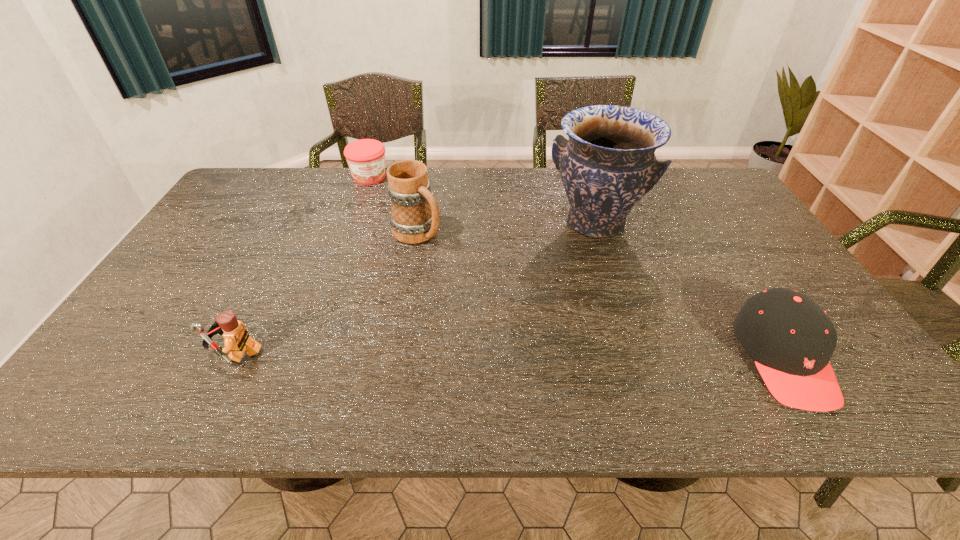
Where is `vacant region located holding a crossbow in the hands of the Lego`? The width and height of the screenshot is (960, 540). vacant region located holding a crossbow in the hands of the Lego is located at coordinates (159, 353).

The image size is (960, 540). Find the location of `vacant space situated on the side of the mug with the handle`. vacant space situated on the side of the mug with the handle is located at coordinates (489, 287).

Where is `free space located 0.120m on the side of the mug with the handle`? free space located 0.120m on the side of the mug with the handle is located at coordinates (461, 266).

At what (x,y) coordinates should I click in order to perform the action: click on vacant space situated on the side of the mug with the handle. Please return your answer as a coordinate pair (x, y). The height and width of the screenshot is (540, 960). Looking at the image, I should click on (444, 254).

Find the location of `vacant region located on the label side of the jam`. vacant region located on the label side of the jam is located at coordinates (385, 223).

Identify the location of vacant space located 0.140m on the label side of the jam. (380, 209).

Image resolution: width=960 pixels, height=540 pixels. Identify the location of vacant space located 0.140m on the label side of the jam. (380, 209).

This screenshot has width=960, height=540. I want to click on vacant space situated on the front handle of the second object from right to left, so click(576, 264).

Image resolution: width=960 pixels, height=540 pixels. I want to click on free region located on the front handle of the second object from right to left, so click(x=552, y=319).

This screenshot has height=540, width=960. I want to click on free location located 0.290m on the front handle of the second object from right to left, so click(552, 319).